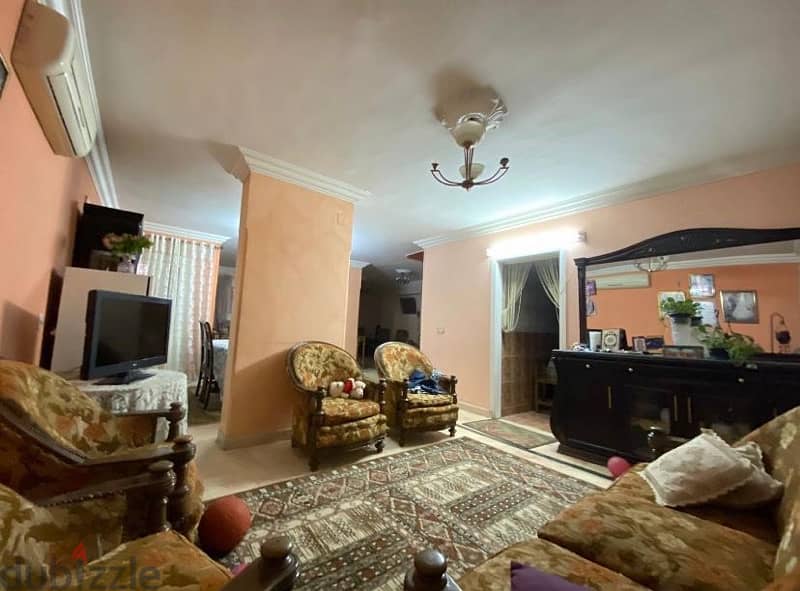
Where is `television`? television is located at coordinates (114, 322).